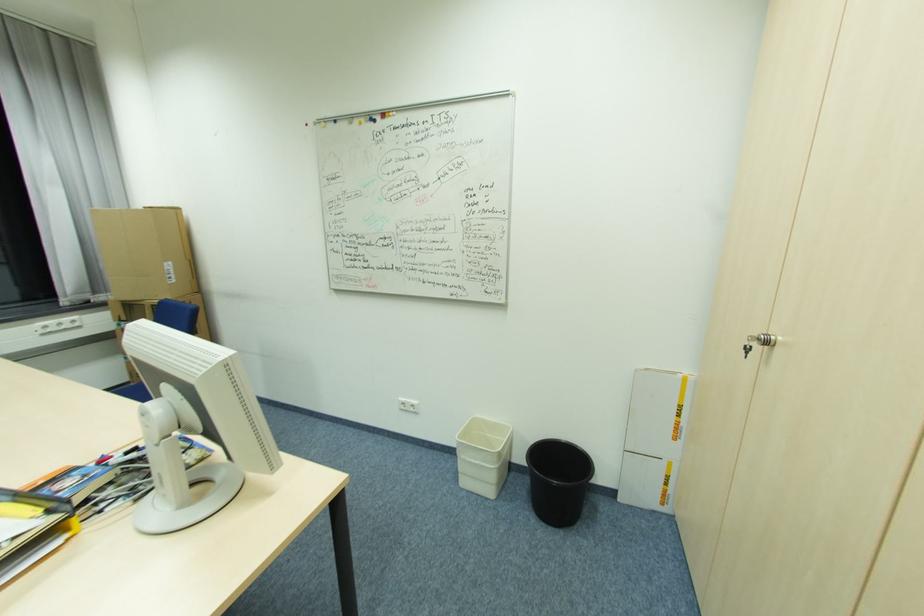
The height and width of the screenshot is (616, 924). Find the location of `white computer monitor`. white computer monitor is located at coordinates (193, 424).